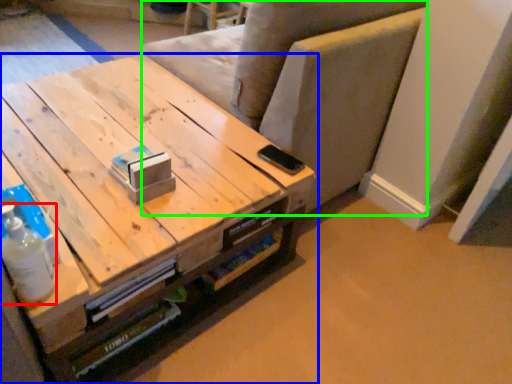
Question: Based on their relative distances, which object is farther from bottle (highlighted by a red box)? Choose from table (highlighted by a blue box) and armchair (highlighted by a green box).

Choices:
 (A) table
 (B) armchair

Answer: (B)